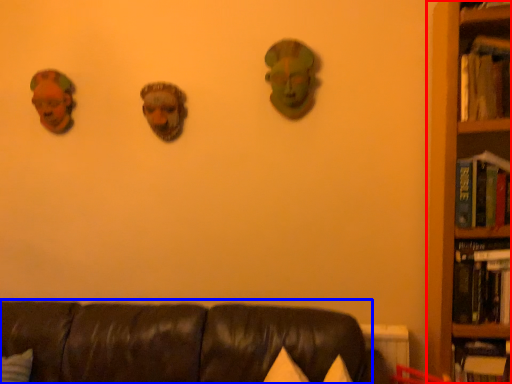
Question: Which of the following is the closest to the observer, bookcase (highlighted by a red box) or studio couch (highlighted by a blue box)?

Choices:
 (A) bookcase
 (B) studio couch

Answer: (B)